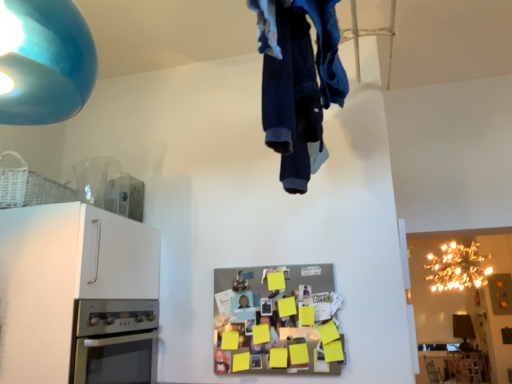
Question: Considering the positions of point (30, 352) and point (224, 357), is point (30, 352) closer or farther from the camera than point (224, 357)?

Choices:
 (A) closer
 (B) farther

Answer: (A)

Question: From a real-world perspective, relative to metallic silver refrigerator at center, is white matte cabinet at left vertically above or below?

Choices:
 (A) below
 (B) above

Answer: (B)

Question: Which object is positioned closest to the stainless steel oven at lower left?

Choices:
 (A) gold metallic chandelier at upper right, the second lamp when ordered from left to right
 (B) metallic silver refrigerator at center
 (C) white matte cabinet at left
 (D) denim fabric pants at upper center
 (E) matte blue lampshade at upper left, which is counted as the first lamp, starting from the front

Answer: (C)

Question: Estimate the real-world distances between objects in this image. Which object is farther from the white matte cabinet at left?

Choices:
 (A) gold metallic chandelier at upper right, the second lamp when ordered from left to right
 (B) denim fabric pants at upper center
 (C) matte blue lampshade at upper left, which is counted as the first lamp, starting from the front
 (D) metallic silver refrigerator at center
 (E) stainless steel oven at lower left

Answer: (A)